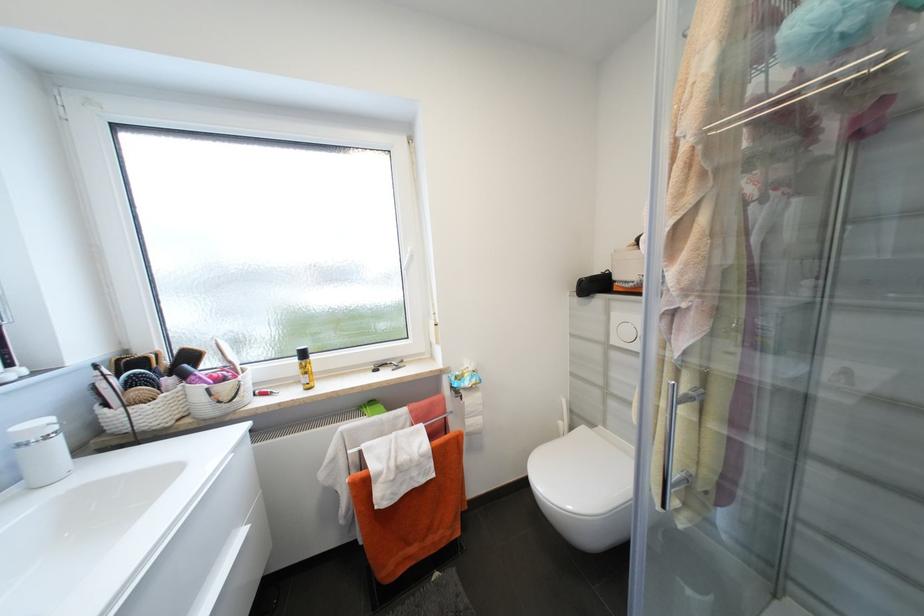
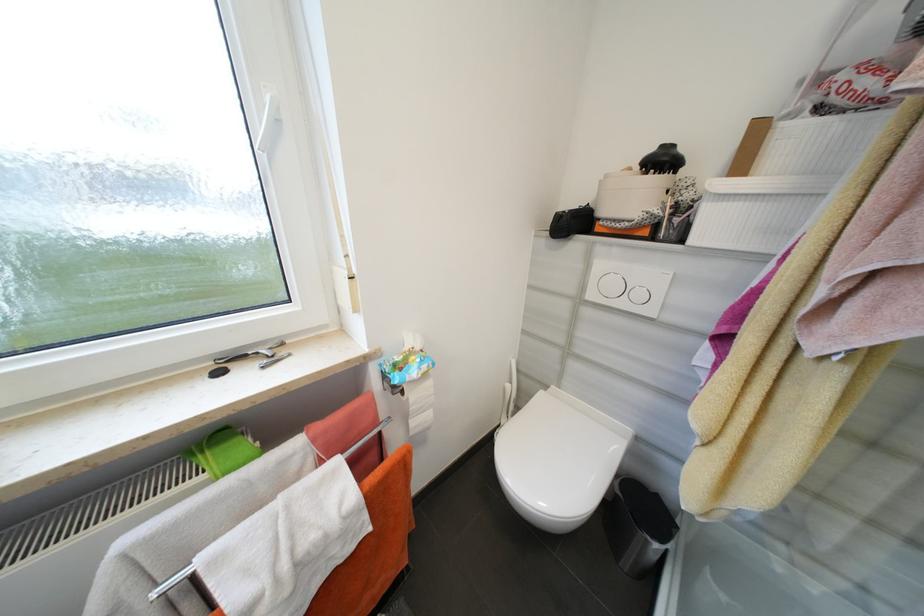
Locate, in the second image, the point that corresponds to (x=565, y=424) in the first image.

(514, 387)